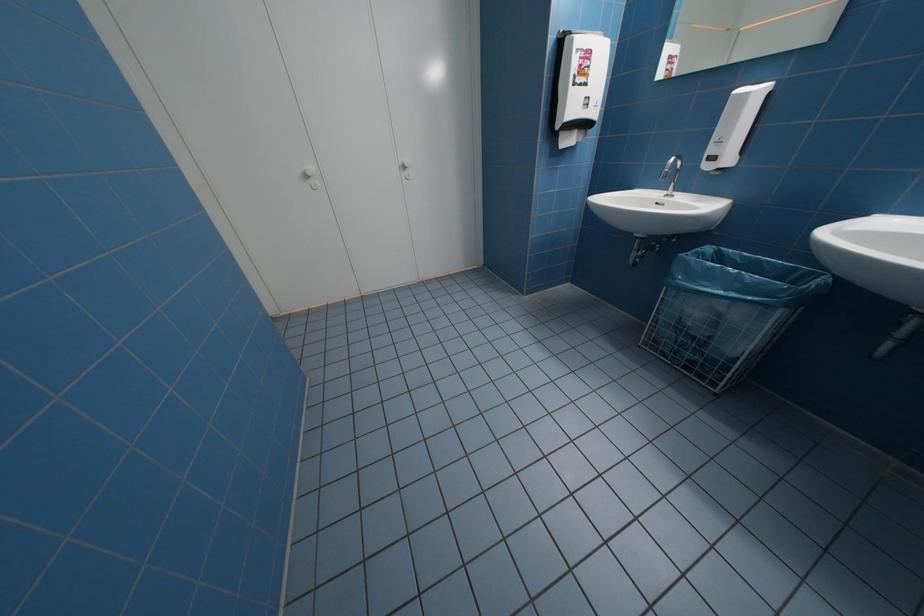
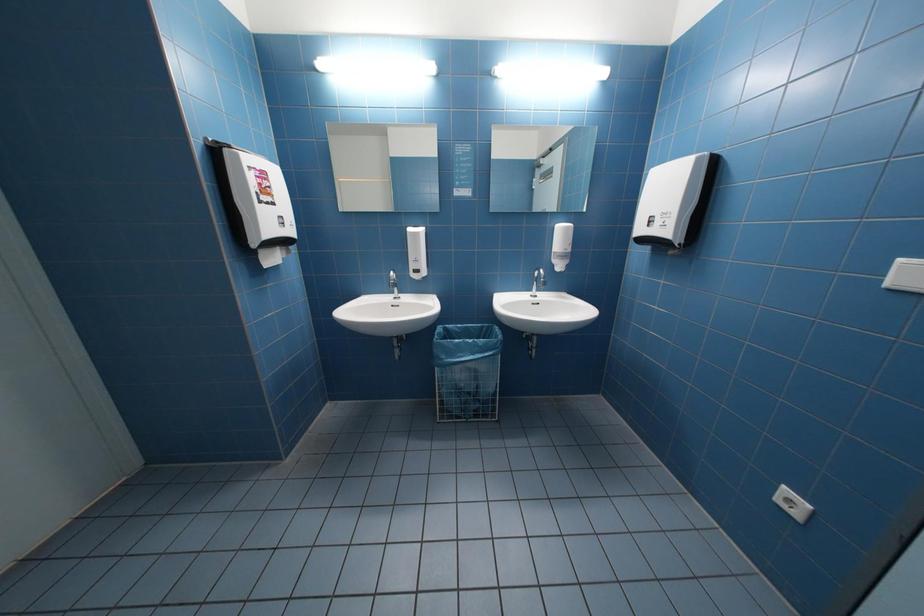
Question: Based on the continuous images, in which direction is the camera rotating? Reply with the corresponding letter.

Choices:
 (A) Left
 (B) Right
 (C) Up
 (D) Down

Answer: (B)